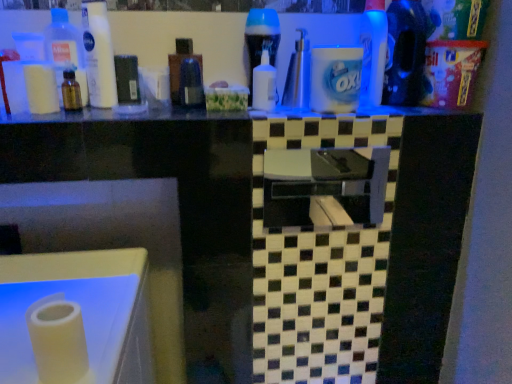
Identify the location of vacant area located to the right-hand side of brown glass bottle at left, the 5th bottle from the right. (151, 109).